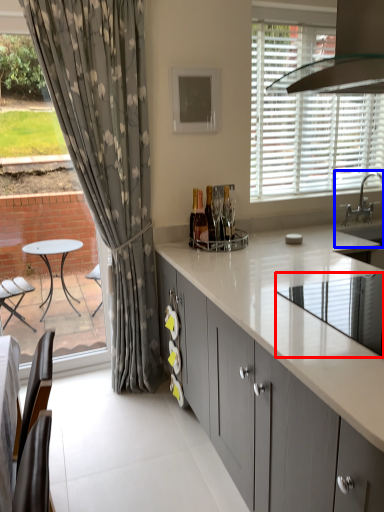
Question: Which point is further to the camera, appliance (highlighted by a red box) or sink (highlighted by a blue box)?

Choices:
 (A) appliance
 (B) sink

Answer: (B)